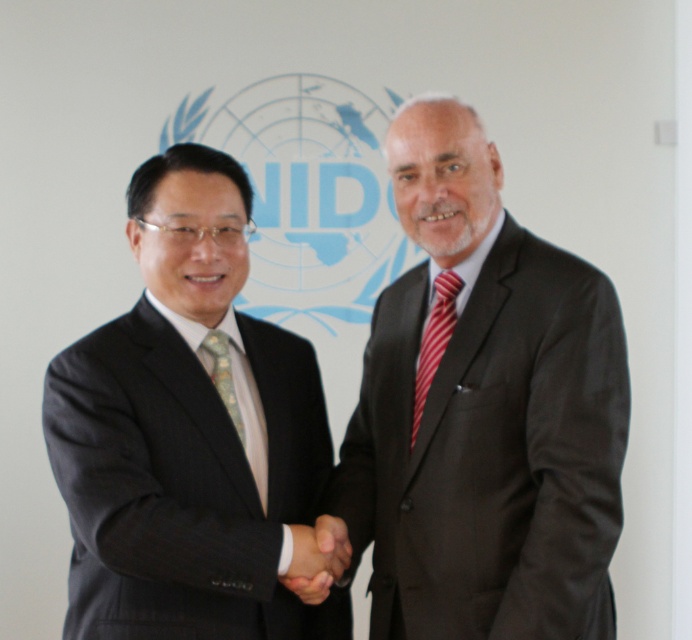
You are an event photographer at the UNIDO ceremony. You need to capture a closeup of the black suit at center and the green textured tie at center. Which object should you zoom in on first to ensure it fits in the frame?

The black suit at center is bigger than the green textured tie at center, so you should zoom in on the black suit at center first to ensure it fits in the frame before adjusting for the smaller green textured tie at center.

Based on the photo, you are a photographer at the UNIDO event and need to ensure that both the black suit at center and the red striped tie at center are visible in the frame. Given that the camera has a fixed focus, which object should you prioritize framing to ensure both are in view?

The black suit at center is wider than the red striped tie at center, so prioritizing framing the black suit at center will ensure both are visible in the frame.

In the image of two men shaking hands in front of the UNIDO logo, where is the black suit at center located relative to the green textured tie at center?

The black suit at center is to the right of the green textured tie at center.